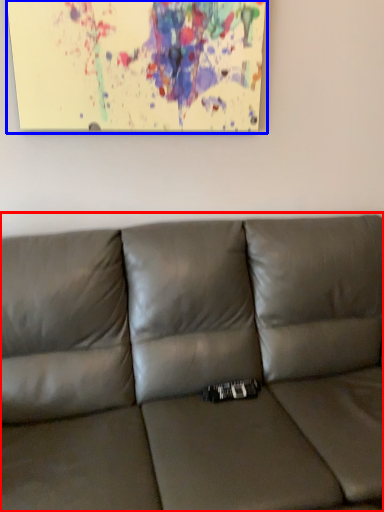
Question: Among these objects, which one is nearest to the camera, studio couch (highlighted by a red box) or picture frame (highlighted by a blue box)?

Choices:
 (A) studio couch
 (B) picture frame

Answer: (A)